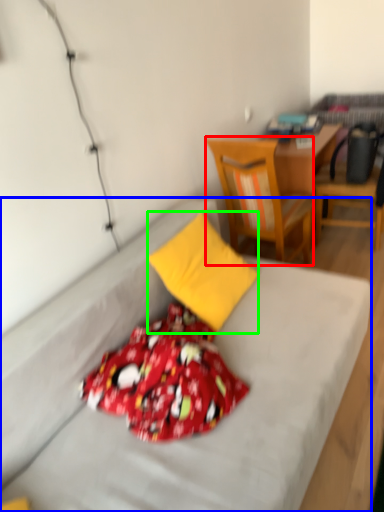
Question: Estimate the real-world distances between objects in this image. Which object is closer to chair (highlighted by a red box), bed (highlighted by a blue box) or pillow (highlighted by a green box)?

Choices:
 (A) bed
 (B) pillow

Answer: (B)